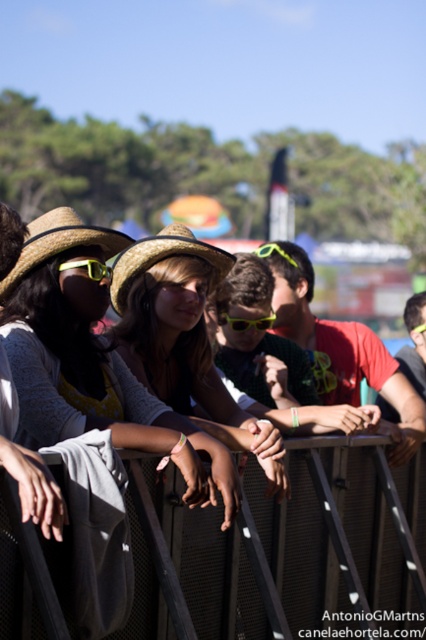
Can you confirm if black metal fence at lower center is shorter than strawhat at center?

Correct, black metal fence at lower center is not as tall as strawhat at center.

Between black metal fence at lower center and strawhat at center, which one has less height?

Standing shorter between the two is black metal fence at lower center.

Image resolution: width=426 pixels, height=640 pixels. Identify the location of black metal fence at lower center. (282, 548).

Identify the location of black metal fence at lower center. The height and width of the screenshot is (640, 426). (282, 548).

Which is in front, point (342, 529) or point (97, 236)?

Point (97, 236) is in front.

Does black metal fence at lower center have a lesser width compared to straw hat at left?

Yes, black metal fence at lower center is thinner than straw hat at left.

This screenshot has width=426, height=640. Identify the location of black metal fence at lower center. (282, 548).

Which is in front, point (25, 248) or point (166, 230)?

Positioned in front is point (25, 248).

Identify the location of straw hat at left. (58, 243).

This screenshot has width=426, height=640. I want to click on straw hat at left, so point(58,243).